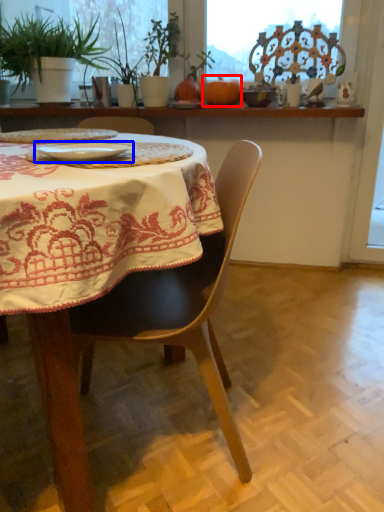
Question: Which object is further to the camera taking this photo, pumpkin (highlighted by a red box) or tableware (highlighted by a blue box)?

Choices:
 (A) pumpkin
 (B) tableware

Answer: (A)